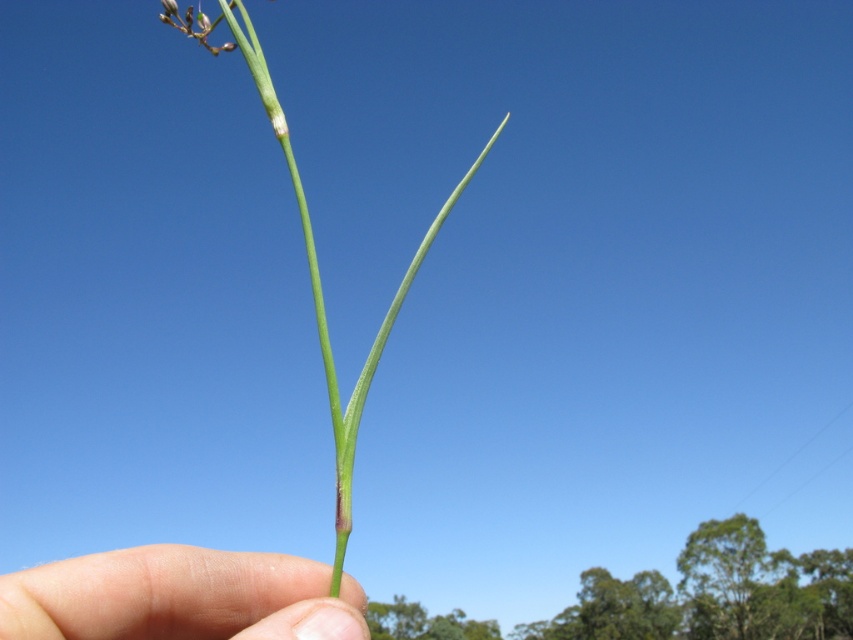
Question: From the image, what is the correct spatial relationship of skin/soft/hand at lower center in relation to green matte stem at center?

Choices:
 (A) above
 (B) below

Answer: (B)

Question: Among these points, which one is farthest from the camera?

Choices:
 (A) (292, 179)
 (B) (328, 604)

Answer: (A)

Question: Is skin/soft/hand at lower center further to camera compared to green matte stem at center?

Choices:
 (A) no
 (B) yes

Answer: (A)

Question: Can you confirm if skin/soft/hand at lower center is thinner than green matte stem at center?

Choices:
 (A) yes
 (B) no

Answer: (A)

Question: Which point is farther from the camera taking this photo?

Choices:
 (A) (344, 548)
 (B) (247, 604)

Answer: (B)